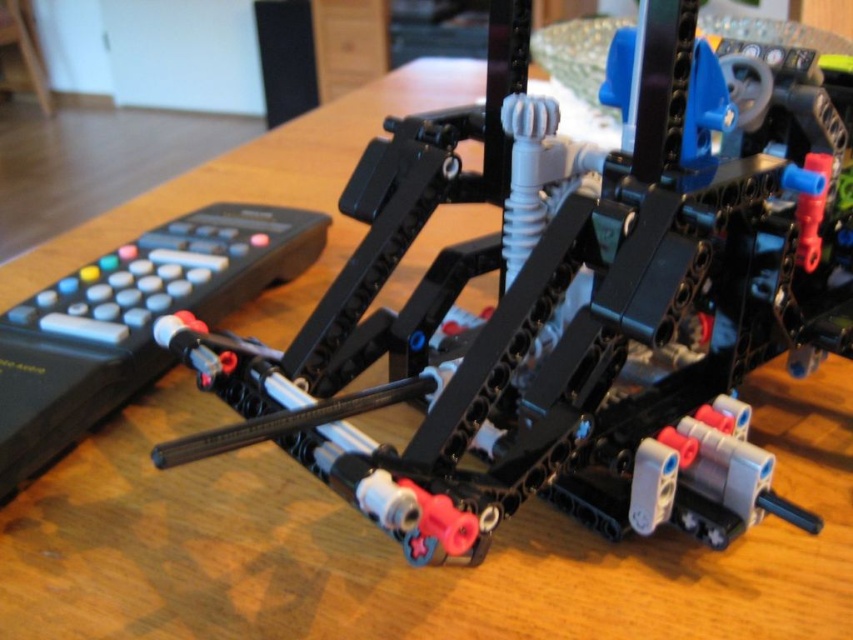
Question: Can you confirm if black plastic toy at center is smaller than black plastic remote at left?

Choices:
 (A) no
 (B) yes

Answer: (A)

Question: Which of the following is the farthest from the observer?

Choices:
 (A) (x=74, y=307)
 (B) (x=679, y=436)

Answer: (A)

Question: Observing the image, what is the correct spatial positioning of black plastic toy at center in reference to black plastic remote at left?

Choices:
 (A) left
 (B) right

Answer: (B)

Question: Where is black plastic toy at center located in relation to black plastic remote at left in the image?

Choices:
 (A) above
 (B) below

Answer: (B)